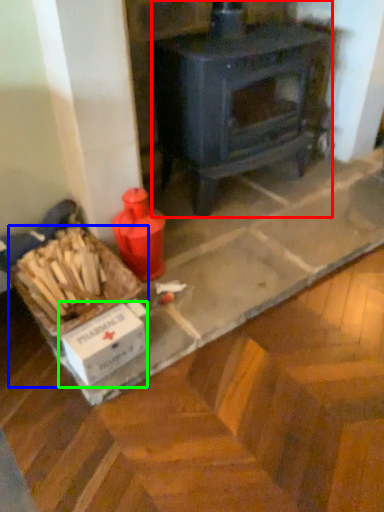
Question: Which is nearer to the wood burning stove (highlighted by a red box)? box (highlighted by a blue box) or cardboard box (highlighted by a green box).

Choices:
 (A) box
 (B) cardboard box

Answer: (A)